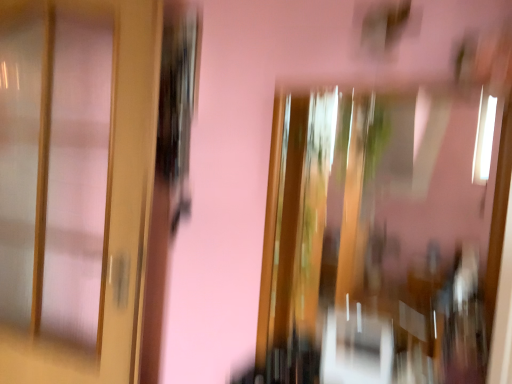
Question: From a real-world perspective, is matte wood door at left positioned above or below transparent glass window at center?

Choices:
 (A) above
 (B) below

Answer: (A)

Question: Relative to transparent glass window at center, is matte wood door at left in front or behind?

Choices:
 (A) behind
 (B) front

Answer: (A)

Question: Is point click(112, 195) positioned closer to the camera than point click(429, 160)?

Choices:
 (A) closer
 (B) farther

Answer: (B)

Question: Looking at the image, does transparent glass window at center seem bigger or smaller compared to matte wood door at left?

Choices:
 (A) big
 (B) small

Answer: (B)

Question: Is transparent glass window at center in front of or behind matte wood door at left in the image?

Choices:
 (A) behind
 (B) front

Answer: (B)

Question: Choose the correct answer: Is transparent glass window at center inside matte wood door at left or outside it?

Choices:
 (A) inside
 (B) outside

Answer: (B)

Question: Visually, is transparent glass window at center positioned to the left or to the right of matte wood door at left?

Choices:
 (A) left
 (B) right

Answer: (B)